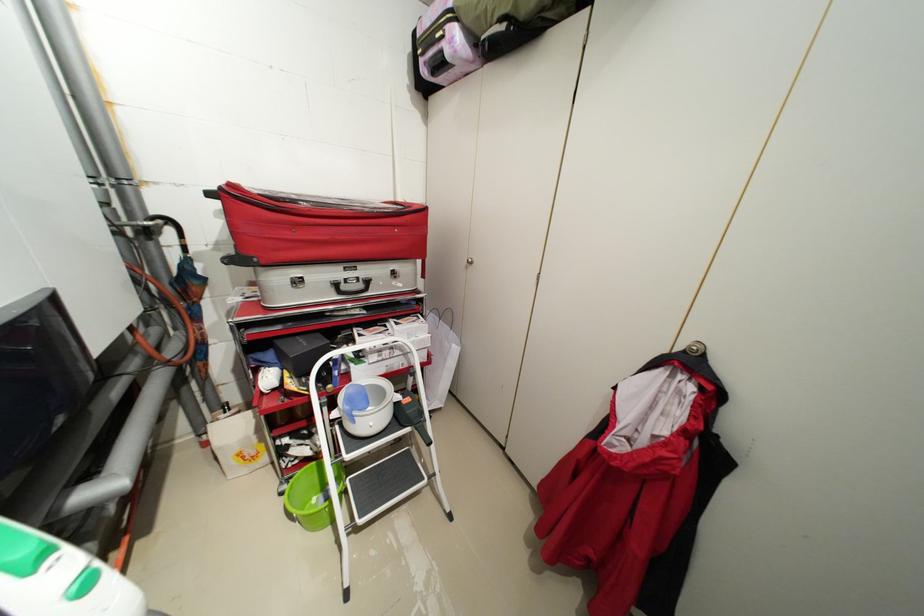
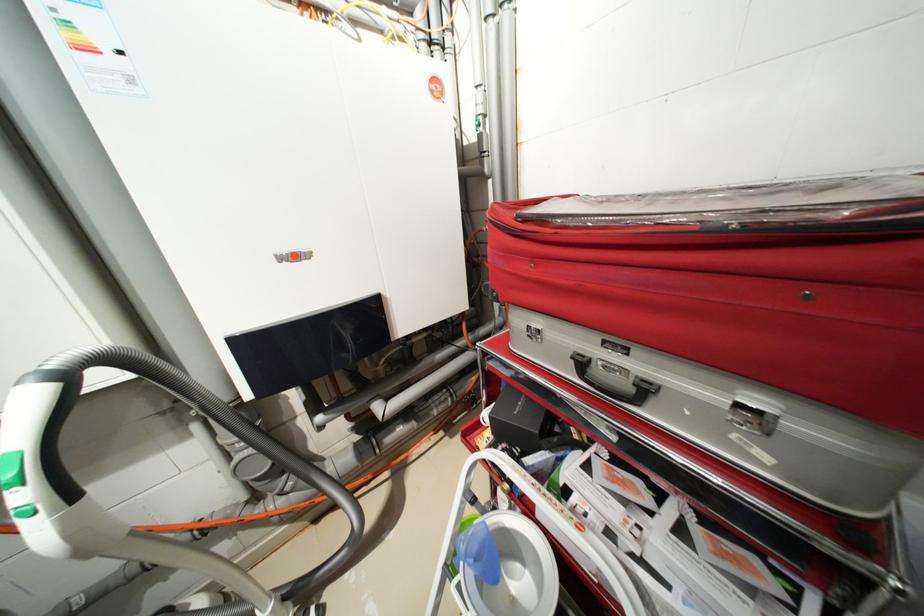
Locate, in the second image, the point that corresponds to pixel 344 286 in the first image.

(589, 363)